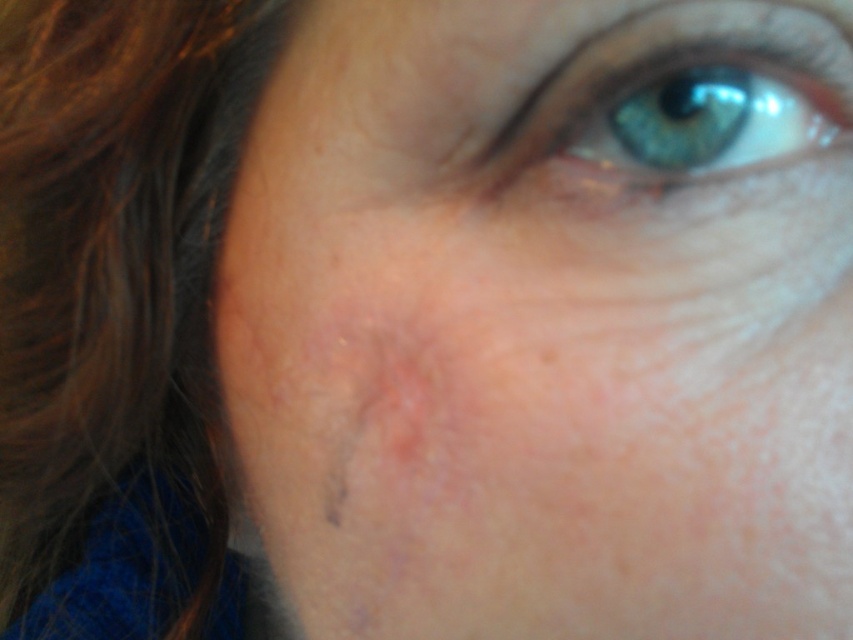
Looking at this image, you are a photographer adjusting the focus on your camera. You want to ensure that both the brown silky hair at left and the blue iridescent eye at upper center are in focus. Based on their positions, which object should you focus on first to achieve this?

The brown silky hair at left is further to the viewer than the blue iridescent eye at upper center. To get both in focus, you should focus on the brown silky hair at left first, as it is closer, and the depth of field will extend backward to include the eye.

You are a photographer adjusting the focus on a portrait. The subject has a scar on their cheek near the eye and some brown silky hair. You want to ensure the scar is in focus while the hair is slightly out of focus. Given that the focus point is set at point (114, 266), which object is currently in focus?

The brown silky hair at left is at point (114, 266), so the focus is on the brown silky hair at left, not the scar.

You are a photographer adjusting the focus on your camera. You want to ensure both the brown silky hair at left and the blue iridescent eye at upper center are in focus. Which object should you adjust the focus towards first to capture both?

The brown silky hair at left is to the left of the blue iridescent eye at upper center, so you should focus on the blue iridescent eye at upper center first as it is closer to the center of the image and likely the main subject, allowing the depth of field to naturally include the brown silky hair at left.